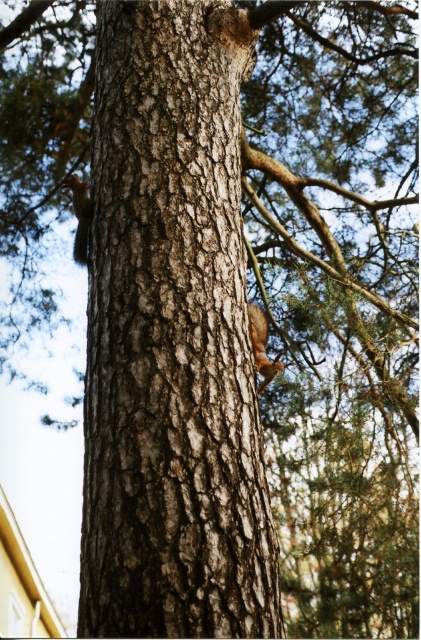
Question: Can you confirm if brown rough bark at center is positioned to the left of brown furry squirrel at center?

Choices:
 (A) no
 (B) yes

Answer: (B)

Question: Does brown rough bark at center appear over brown furry squirrel at left?

Choices:
 (A) yes
 (B) no

Answer: (B)

Question: Considering the real-world distances, which object is farthest from the brown furry squirrel at left?

Choices:
 (A) brown rough bark at center
 (B) brown furry squirrel at center

Answer: (A)

Question: Which of the following is the farthest from the observer?

Choices:
 (A) (77, 244)
 (B) (255, 310)
 (C) (141, 20)

Answer: (A)

Question: Among these objects, which one is farthest from the camera?

Choices:
 (A) brown furry squirrel at left
 (B) brown rough bark at center
 (C) brown furry squirrel at center

Answer: (A)

Question: Does brown rough bark at center appear over brown furry squirrel at left?

Choices:
 (A) no
 (B) yes

Answer: (A)